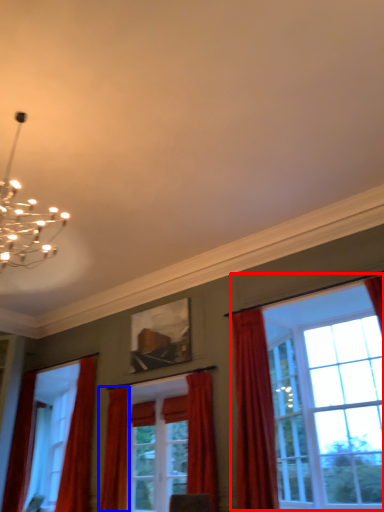
Question: Which point is further to the camera, window (highlighted by a red box) or curtain (highlighted by a blue box)?

Choices:
 (A) window
 (B) curtain

Answer: (B)